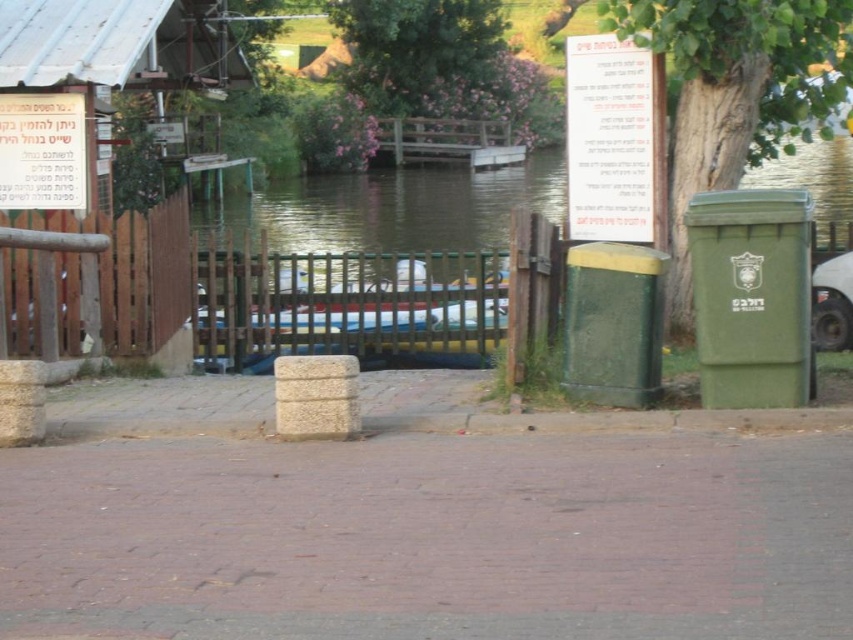
You are a visitor at the riverside area and want to dispose of a small piece of paper. You see a green textured bin at center and a white paper sign at upper center. Which object is located lower in the scene?

The green textured bin at center is positioned over the white paper sign at upper center, meaning the bin is lower than the sign.

You are a visitor at the riverside and want to dispose of your trash. You see the green textured bin at center and the brown wooden fence at left. Which object is nearer to you?

The green textured bin at center is closer to the viewer than the brown wooden fence at left, so the bin is nearer.

You are standing at the entrance of the wooden gate and want to dispose of some trash. There is a green textured bin at center. Can you walk straight ahead from the gate to reach the bin without needing to go around any obstacles?

The green textured bin at center is located at point (737, 92), which suggests it is positioned in the central area of the scene. Since the paved brick pathway leads towards the gate and the bin is centrally located, it is likely that walking straight ahead from the gate would allow you to reach the bin without encountering obstacles. However, the exact path depends on the layout not explicitly mentioned, but based on the given information, proceeding straight seems feasible.